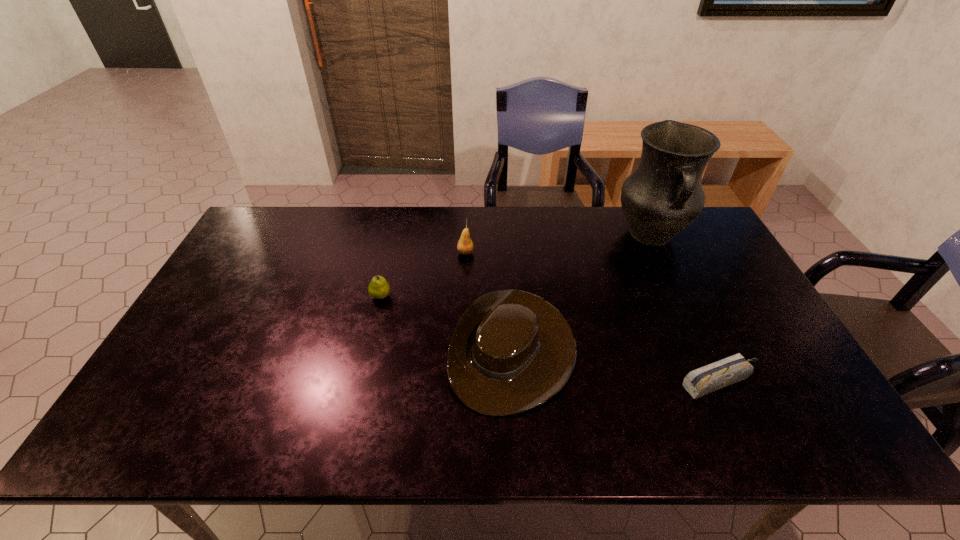
Find the location of `free point between the shortest object and the second tallest object`. free point between the shortest object and the second tallest object is located at coordinates (593, 318).

Image resolution: width=960 pixels, height=540 pixels. In order to click on unoccupied position between the nearer pear and the tallest object in this screenshot , I will do click(x=516, y=266).

Identify the location of the closest object relative to the nearer pear. (511, 351).

Locate which object is the second closest to the left pear. Please provide its 2D coordinates. Your answer should be formatted as a tuple, i.e. [(x, y)], where the tuple contains the x and y coordinates of a point satisfying the conditions above.

[(465, 246)]

Identify the location of free space that satisfies the following two spatial constraints: 1. on the front side of the taller pear; 2. on the left side of the pencil box. Image resolution: width=960 pixels, height=540 pixels. (461, 382).

The height and width of the screenshot is (540, 960). Find the location of `free location that satisfies the following two spatial constraints: 1. on the handle side of the shortest object; 2. on the left side of the pitcher`. free location that satisfies the following two spatial constraints: 1. on the handle side of the shortest object; 2. on the left side of the pitcher is located at coordinates (718, 382).